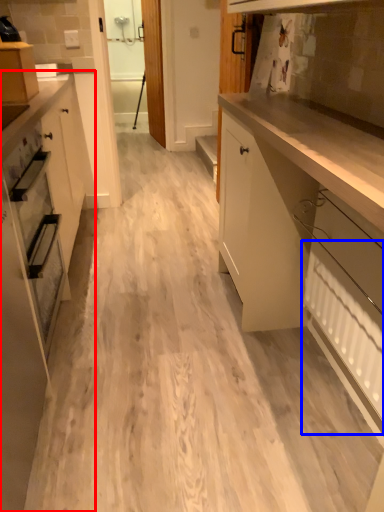
Question: Among these objects, which one is farthest to the camera, cabinetry (highlighted by a red box) or radiator (highlighted by a blue box)?

Choices:
 (A) cabinetry
 (B) radiator

Answer: (B)